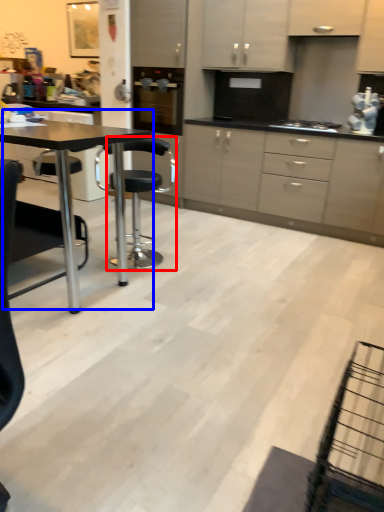
Question: Which of the following is the farthest to the observer, chair (highlighted by a red box) or table (highlighted by a blue box)?

Choices:
 (A) chair
 (B) table

Answer: (A)